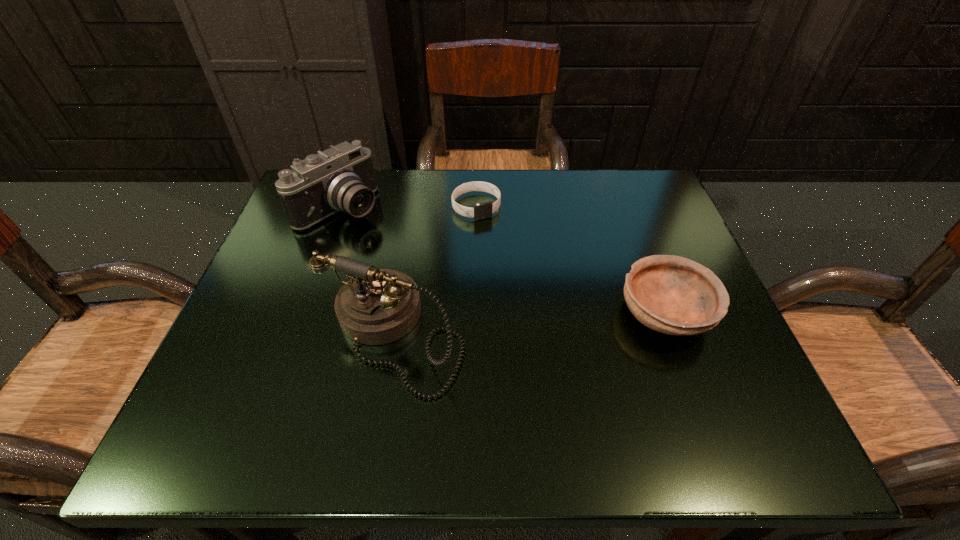
You are a GUI agent. You are given a task and a screenshot of the screen. Output one action in this format:
    pyautogui.click(x=<x>, y=<y>)
    Task: Click on the vacant space on the desktop that is between the telephone and the second shortest object and is positioned on the front-facing side of the camera
    
    Given the screenshot: What is the action you would take?
    pyautogui.click(x=510, y=326)

The height and width of the screenshot is (540, 960). I want to click on vacant space on the desktop that is between the telephone and the bowl and is positioned on the outer surface of the shortest object, so click(x=543, y=323).